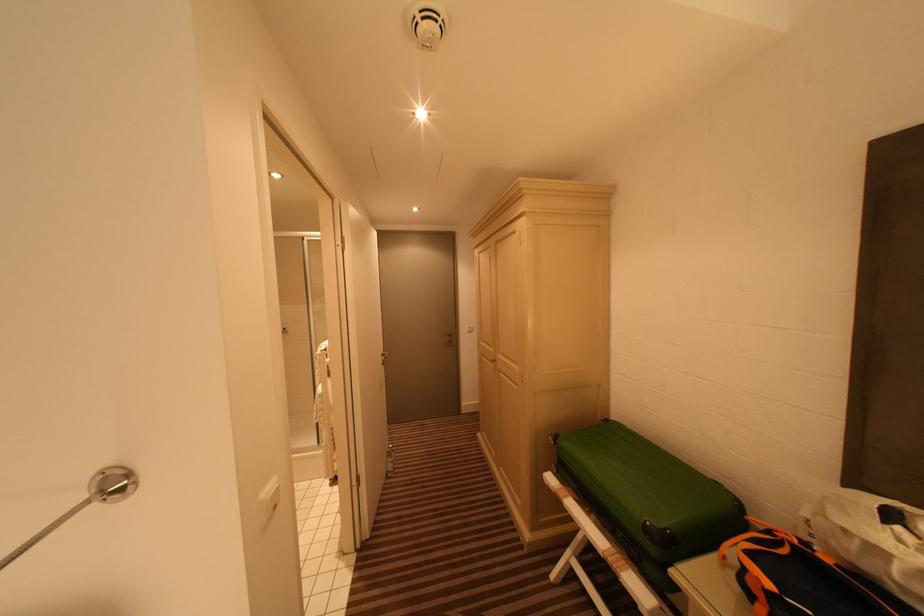
I want to click on grey door handle, so [x=488, y=358].